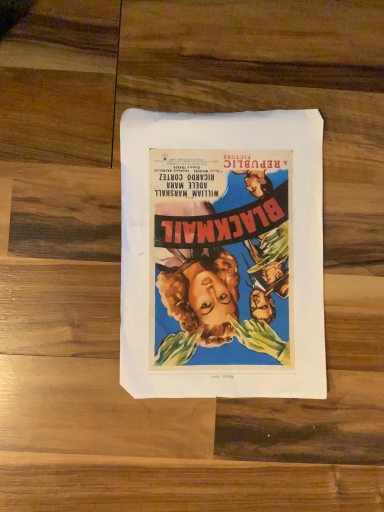
Locate an element on the screen. blank space situated above vibrant paper poster at center (from a real-world perspective) is located at coordinates (225, 254).